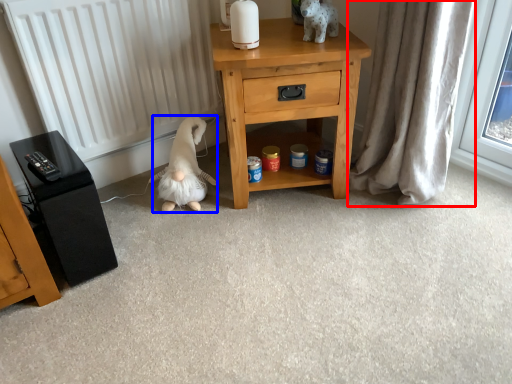
Question: Which object is closer to the camera taking this photo, curtain (highlighted by a red box) or animal (highlighted by a blue box)?

Choices:
 (A) curtain
 (B) animal

Answer: (A)